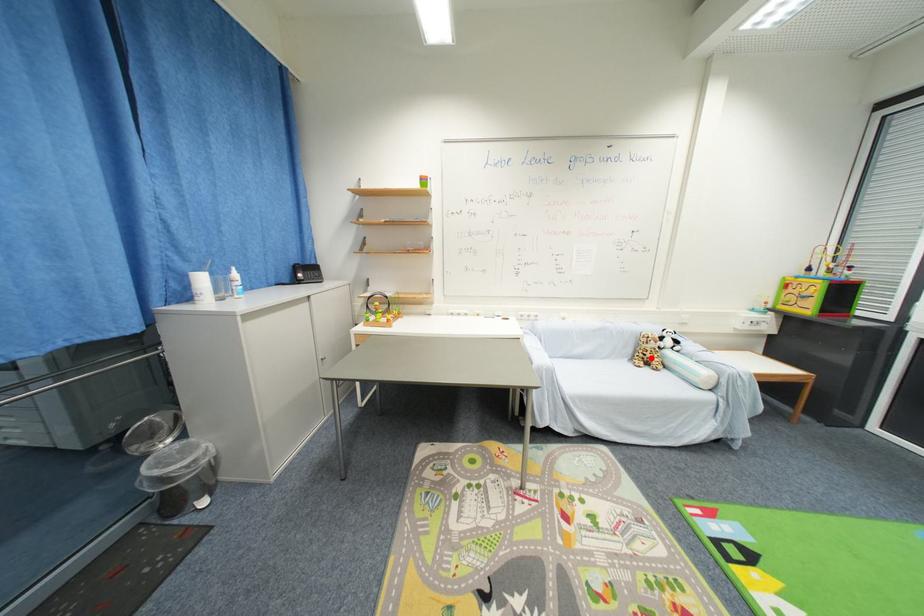
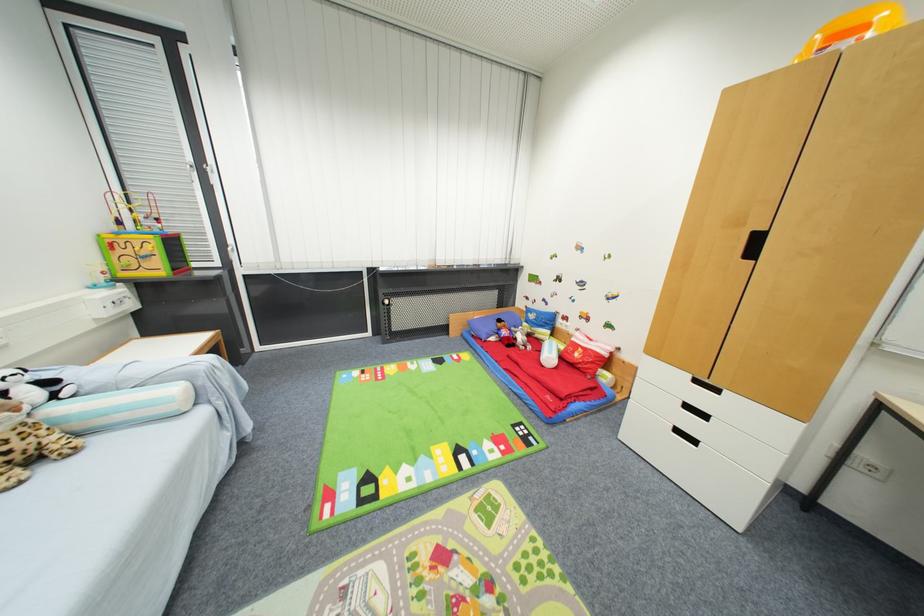
Locate, in the second image, the point that corresponds to the highlighted location in the first image.

(7, 456)